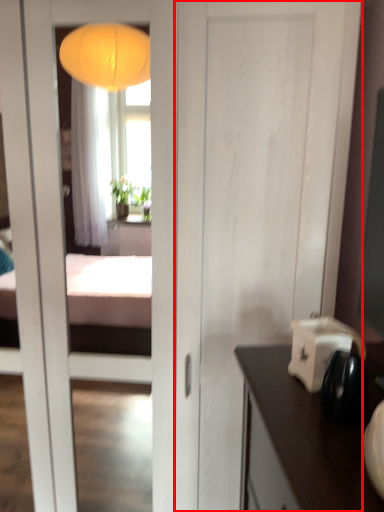
Question: Observing the image, what is the correct spatial positioning of door (annotated by the red box) in reference to appliance?

Choices:
 (A) right
 (B) left

Answer: (B)